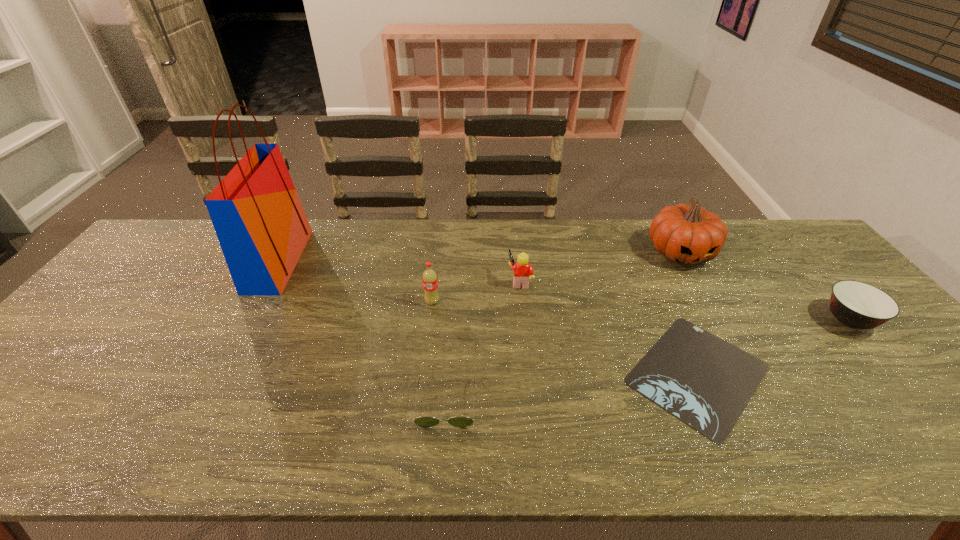
Locate an element on the screen. vacant space situated 0.360m on the handle side of the leftmost object is located at coordinates (415, 261).

Find the location of a particular element. vacant space located on the face of the pumpkin is located at coordinates (732, 343).

The width and height of the screenshot is (960, 540). In order to click on free location located on the right of the third tallest object in this screenshot , I will do `click(475, 302)`.

Locate an element on the screen. The image size is (960, 540). free space located in front of the Lego with the accessory visible is located at coordinates (429, 281).

Locate an element on the screen. Image resolution: width=960 pixels, height=540 pixels. vacant region located 0.180m in front of the Lego with the accessory visible is located at coordinates (446, 281).

You are a GUI agent. You are given a task and a screenshot of the screen. Output one action in this format:
    pyautogui.click(x=<x>, y=<y>)
    Task: Click on the vacant point located 0.380m in front of the Lego with the accessory visible
    The width and height of the screenshot is (960, 540).
    Given the screenshot: What is the action you would take?
    [x=379, y=281]

The width and height of the screenshot is (960, 540). What are the coordinates of `vacant space situated on the back of the soup bowl` in the screenshot? It's located at (788, 249).

You are a GUI agent. You are given a task and a screenshot of the screen. Output one action in this format:
    pyautogui.click(x=<x>, y=<y>)
    Task: Click on the vacant space located on the front-facing side of the second shortest object
    Image resolution: width=960 pixels, height=540 pixels.
    Given the screenshot: What is the action you would take?
    pyautogui.click(x=443, y=455)

What are the coordinates of `free space located 0.100m on the back of the mousepad` in the screenshot? It's located at (661, 293).

Where is `shopping bag located at the far edge`? shopping bag located at the far edge is located at coordinates pos(262,228).